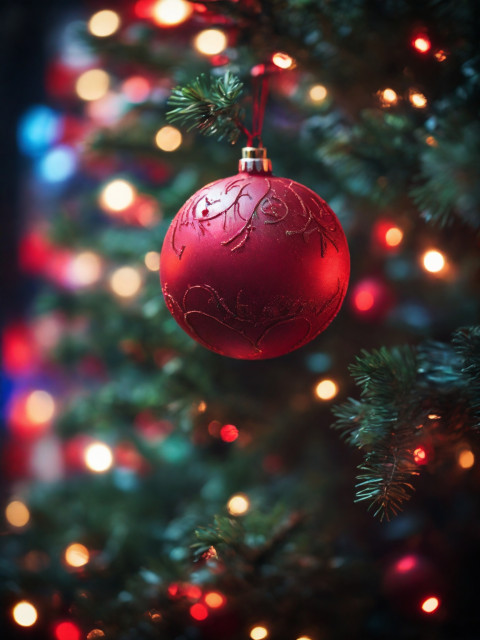
Locate an element on the screen. The height and width of the screenshot is (640, 480). orange light is located at coordinates (466, 458).